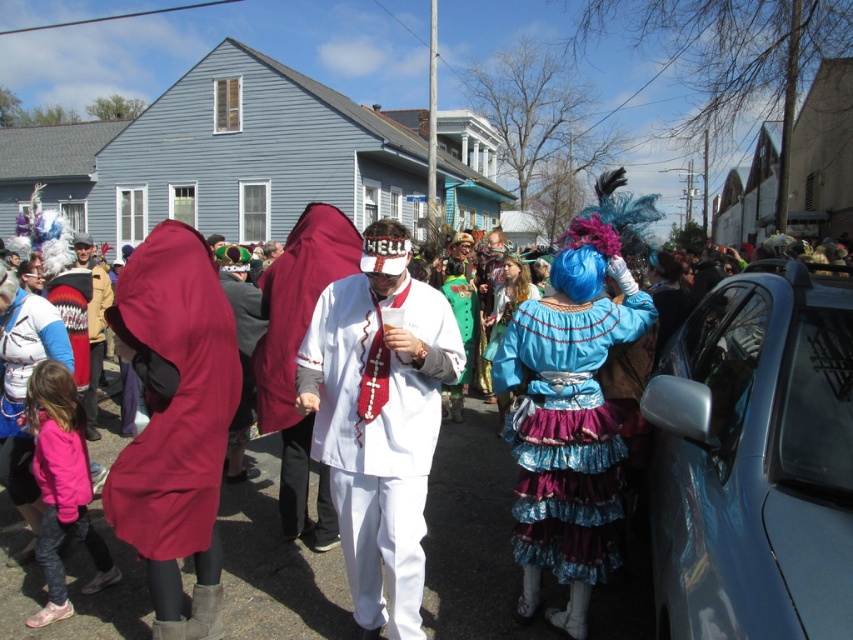
Question: Can you confirm if white matte suit at center is positioned below shiny blue fabric dress at center?

Choices:
 (A) yes
 (B) no

Answer: (B)

Question: Can you confirm if blue metallic car at right is positioned above white matte suit at center?

Choices:
 (A) no
 (B) yes

Answer: (B)

Question: Based on their relative distances, which object is farther from the shiny blue fabric dress at center?

Choices:
 (A) white matte suit at center
 (B) blue metallic car at right

Answer: (A)

Question: Based on their relative distances, which object is farther from the velvet maroon cape at left?

Choices:
 (A) white matte suit at center
 (B) blue metallic car at right

Answer: (B)

Question: Is white matte suit at center positioned at the back of velvet maroon cape at left?

Choices:
 (A) yes
 (B) no

Answer: (B)

Question: Which object is closer to the camera taking this photo?

Choices:
 (A) white matte suit at center
 (B) velvet maroon cape at left
 (C) shiny blue fabric dress at center

Answer: (A)